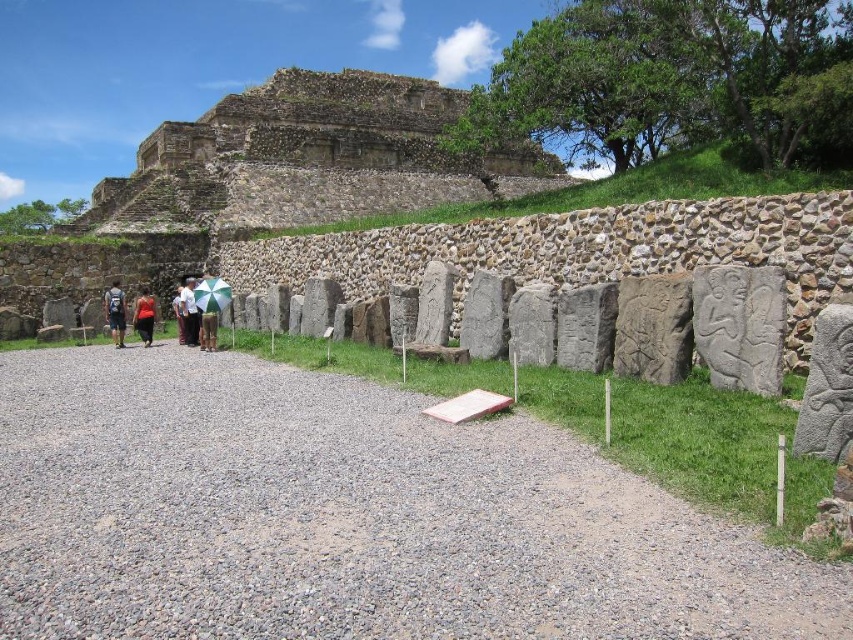
Which is more to the left, gray gravel path at center or brown fabric shirt at center?

From the viewer's perspective, brown fabric shirt at center appears more on the left side.

Does point (96, 614) come behind point (181, 285)?

That is False.

Image resolution: width=853 pixels, height=640 pixels. In order to click on gray gravel path at center in this screenshot , I will do `click(347, 516)`.

Can you confirm if dark blue backpack at center is positioned to the right of brown leather jacket at center?

No, dark blue backpack at center is not to the right of brown leather jacket at center.

Does dark blue backpack at center have a lesser height compared to brown leather jacket at center?

Correct, dark blue backpack at center is not as tall as brown leather jacket at center.

Identify the location of dark blue backpack at center. The width and height of the screenshot is (853, 640). (115, 312).

Where is `dark blue backpack at center`? The image size is (853, 640). dark blue backpack at center is located at coordinates (115, 312).

You are a GUI agent. You are given a task and a screenshot of the screen. Output one action in this format:
    pyautogui.click(x=<x>, y=<y>)
    Task: Click on the brown leather jacket at center
    
    Given the screenshot: What is the action you would take?
    pyautogui.click(x=189, y=312)

Is brown leather jacket at center to the right of brown fabric shirt at center from the viewer's perspective?

Indeed, brown leather jacket at center is positioned on the right side of brown fabric shirt at center.

Which is in front, point (189, 298) or point (180, 307)?

Point (189, 298) is in front.

Where is `brown leather jacket at center`? The height and width of the screenshot is (640, 853). brown leather jacket at center is located at coordinates (189, 312).